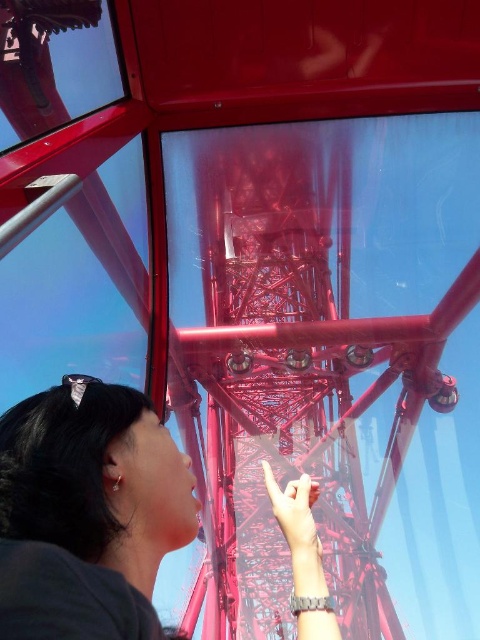
Question: Does metallic red eiffel tower at center appear on the left side of matte black hair at upper left?

Choices:
 (A) no
 (B) yes

Answer: (A)

Question: Which point is farther to the camera?

Choices:
 (A) click(x=292, y=522)
 (B) click(x=303, y=192)

Answer: (B)

Question: Considering the relative positions of metallic red eiffel tower at center and matte black hair at upper left in the image provided, where is metallic red eiffel tower at center located with respect to matte black hair at upper left?

Choices:
 (A) above
 (B) below

Answer: (A)

Question: Can you confirm if metallic red eiffel tower at center is wider than matte black hair at upper left?

Choices:
 (A) no
 (B) yes

Answer: (A)

Question: Which of the following is the closest to the observer?

Choices:
 (A) (326, 225)
 (B) (181, 461)

Answer: (B)